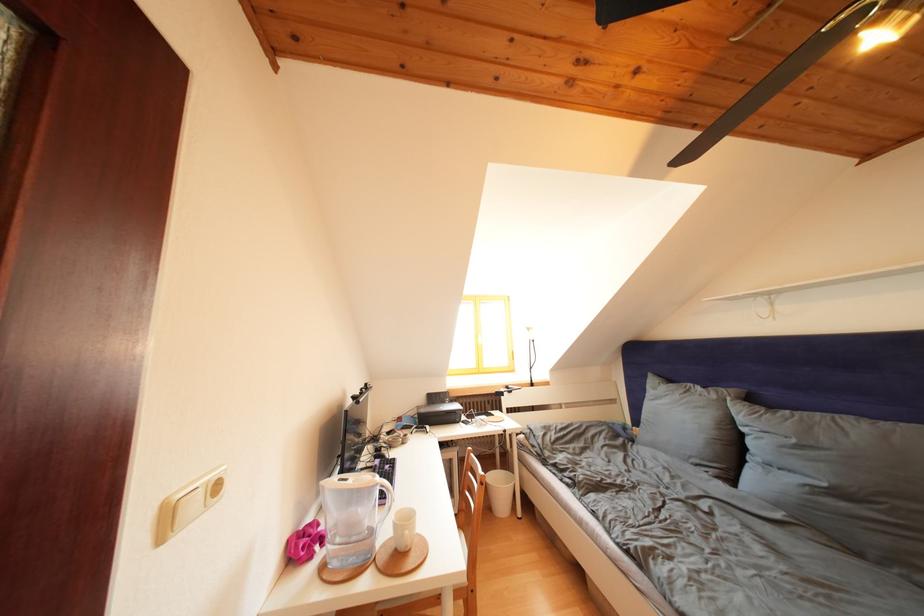
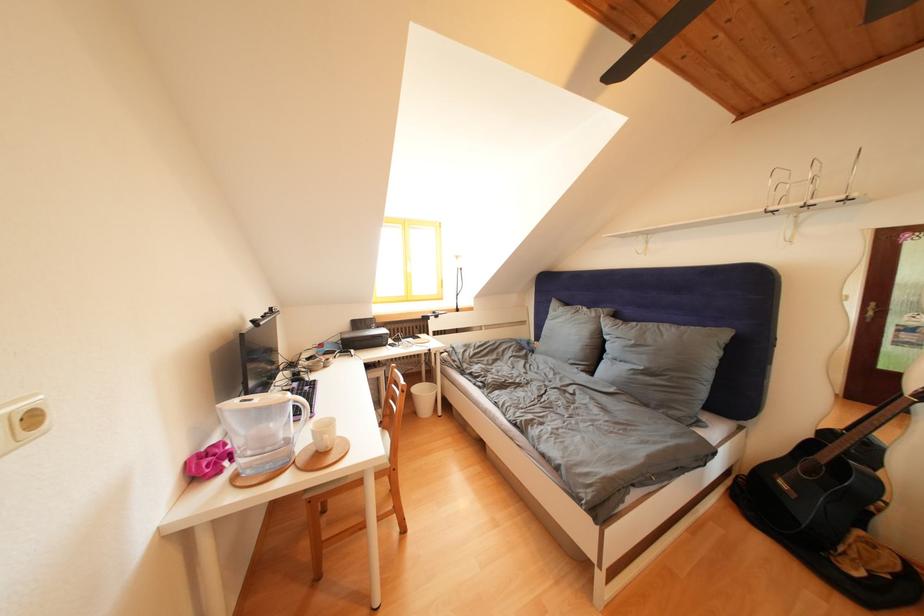
Locate, in the second image, the point that corresponds to (395,472) in the first image.

(314, 392)